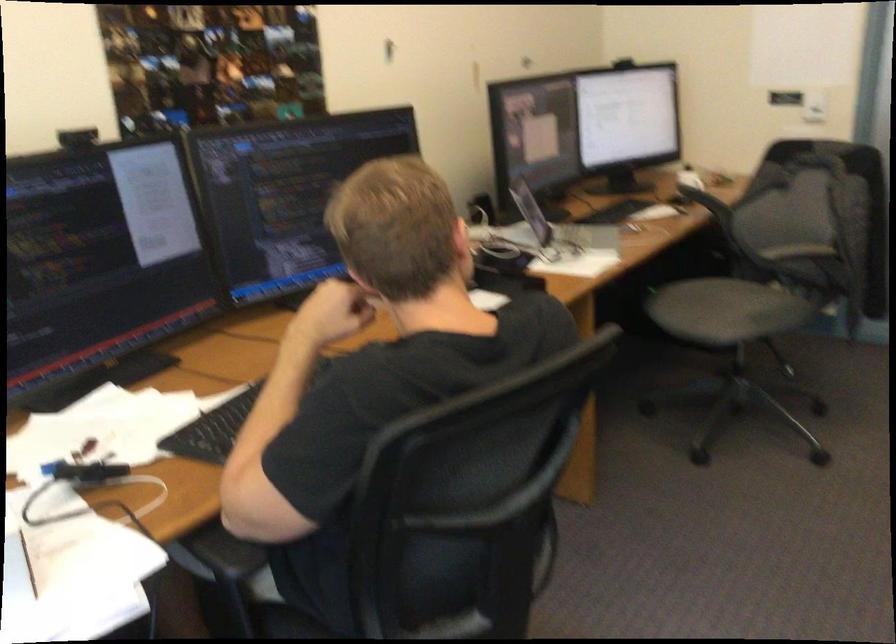
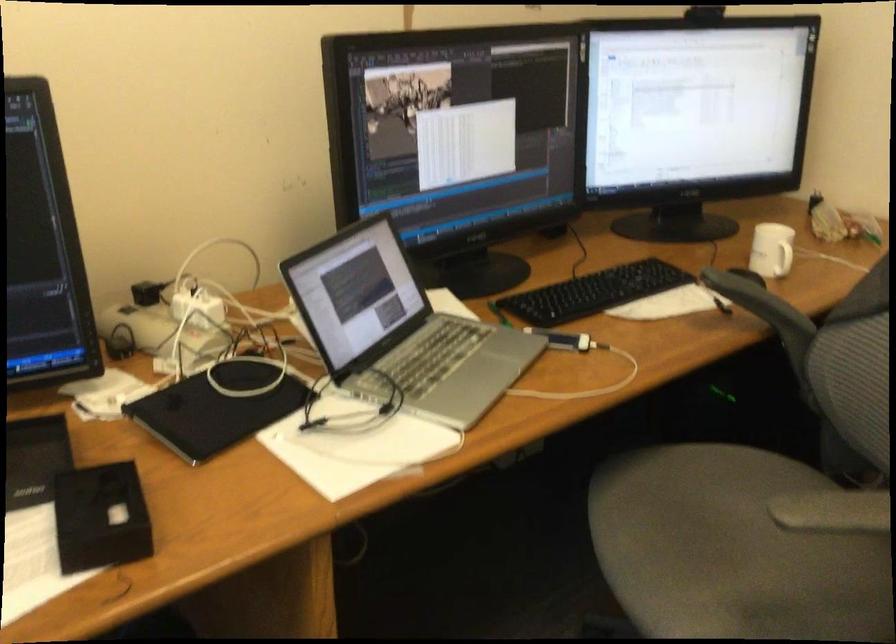
Which direction would the cameraman need to move to produce the second image?

The cameraman moved toward right, forward.